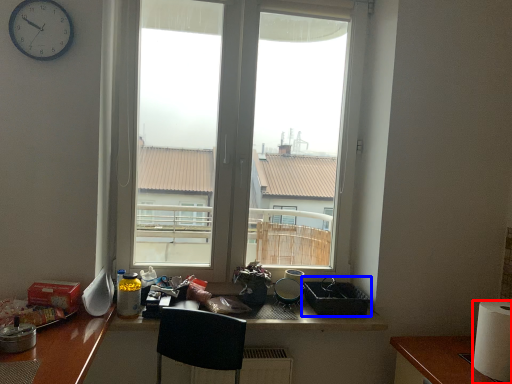
Question: Which object appears farthest to the camera in this image, paper towel (highlighted by a red box) or appliance (highlighted by a blue box)?

Choices:
 (A) paper towel
 (B) appliance

Answer: (B)